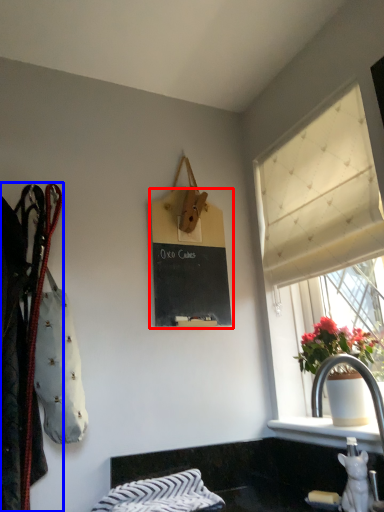
Question: Among these objects, which one is farthest to the camera, bulletin board (highlighted by a red box) or closet (highlighted by a blue box)?

Choices:
 (A) bulletin board
 (B) closet

Answer: (A)